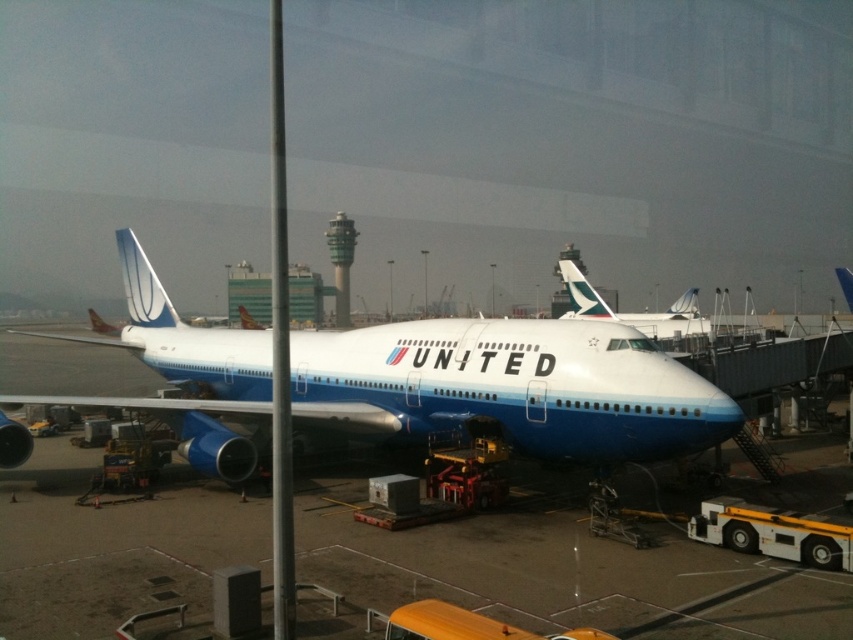
Who is positioned more to the left, white glossy airplane at center or blue polished airplane at center?

white glossy airplane at center

At what (x,y) coordinates should I click in order to perform the action: click on white glossy airplane at center. Please return your answer as a coordinate pair (x, y). This screenshot has width=853, height=640. Looking at the image, I should click on (509, 387).